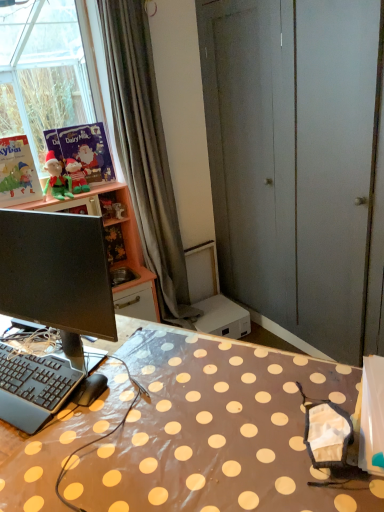
Question: From a real-world perspective, is matte pink cabinet at upper left physically below matte green plush at upper left, which appears as the 1th person when viewed from the right?

Choices:
 (A) yes
 (B) no

Answer: (A)

Question: Is matte pink cabinet at upper left positioned in front of matte green plush at upper left, which is the 2th person in left-to-right order?

Choices:
 (A) no
 (B) yes

Answer: (B)

Question: Does matte pink cabinet at upper left have a lesser width compared to matte green plush at upper left, which appears as the 1th person when viewed from the right?

Choices:
 (A) no
 (B) yes

Answer: (A)

Question: Can you confirm if matte pink cabinet at upper left is bigger than matte green plush at upper left, which is the 2th person in left-to-right order?

Choices:
 (A) no
 (B) yes

Answer: (B)

Question: From the image's perspective, is matte pink cabinet at upper left below matte green plush at upper left, which is the 2th person in left-to-right order?

Choices:
 (A) yes
 (B) no

Answer: (A)

Question: Does matte pink cabinet at upper left have a greater height compared to matte green plush at upper left, which appears as the 1th person when viewed from the right?

Choices:
 (A) no
 (B) yes

Answer: (B)

Question: Is matte paper book at upper left, which ranks as the 1th book in right-to-left order, facing away from matte pink cabinet at upper left?

Choices:
 (A) yes
 (B) no

Answer: (B)

Question: Considering the relative positions of matte paper book at upper left, which ranks as the 1th book in right-to-left order, and matte pink cabinet at upper left in the image provided, is matte paper book at upper left, which ranks as the 1th book in right-to-left order, to the left of matte pink cabinet at upper left from the viewer's perspective?

Choices:
 (A) yes
 (B) no

Answer: (A)

Question: Does matte paper book at upper left, the second book viewed from the left, have a greater height compared to matte pink cabinet at upper left?

Choices:
 (A) yes
 (B) no

Answer: (B)

Question: Is matte paper book at upper left, the second book viewed from the left, not near matte pink cabinet at upper left?

Choices:
 (A) no
 (B) yes

Answer: (A)

Question: Is matte paper book at upper left, which ranks as the 1th book in right-to-left order, to the right of matte pink cabinet at upper left from the viewer's perspective?

Choices:
 (A) yes
 (B) no

Answer: (B)

Question: Does matte paper book at upper left, which ranks as the 1th book in right-to-left order, have a lesser width compared to matte pink cabinet at upper left?

Choices:
 (A) yes
 (B) no

Answer: (A)

Question: Is matte green plush at upper left, which appears as the 1th person when viewed from the right, positioned in front of green plush elf at left, the 2th person from the right?

Choices:
 (A) yes
 (B) no

Answer: (B)